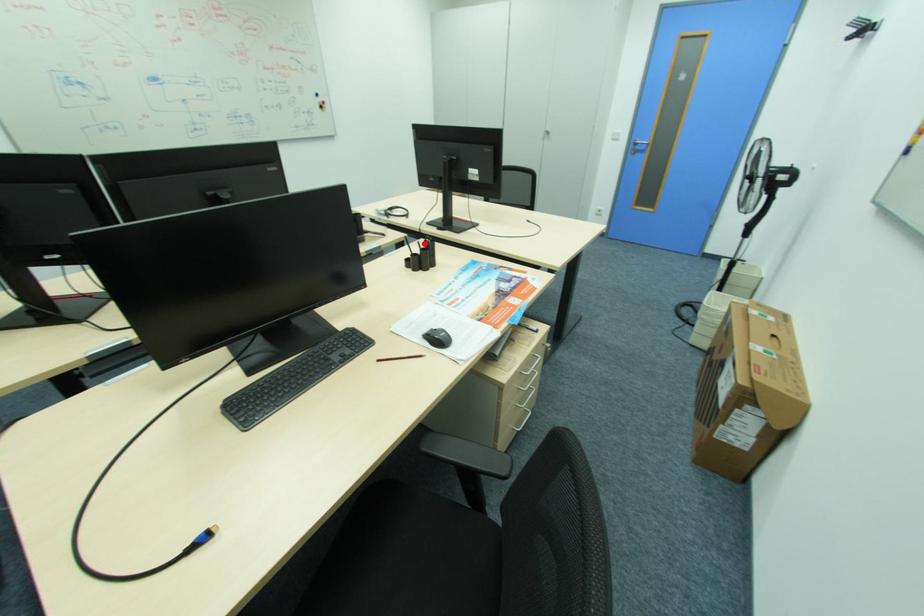
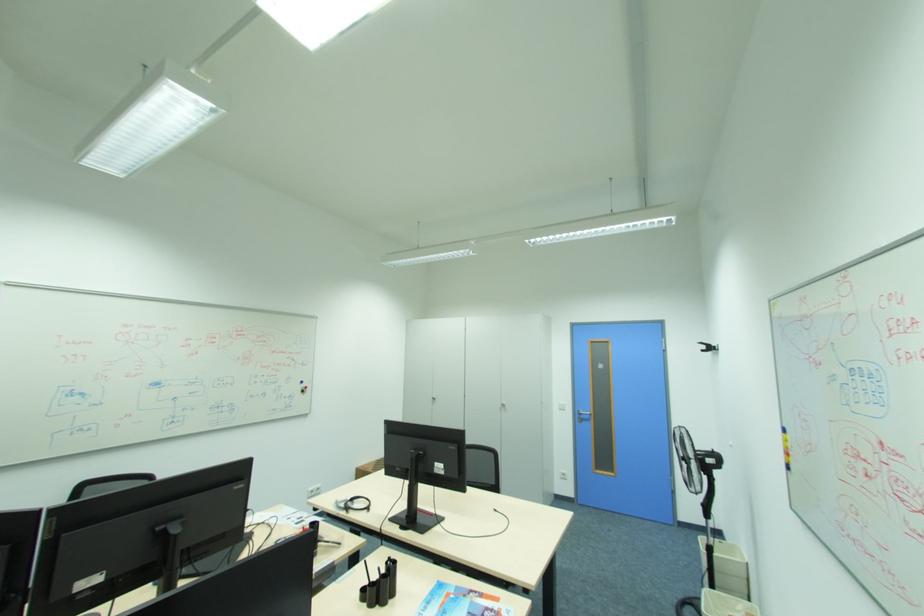
Locate, in the second image, the point that corresponds to the highlighted location in the first image.

(383, 570)